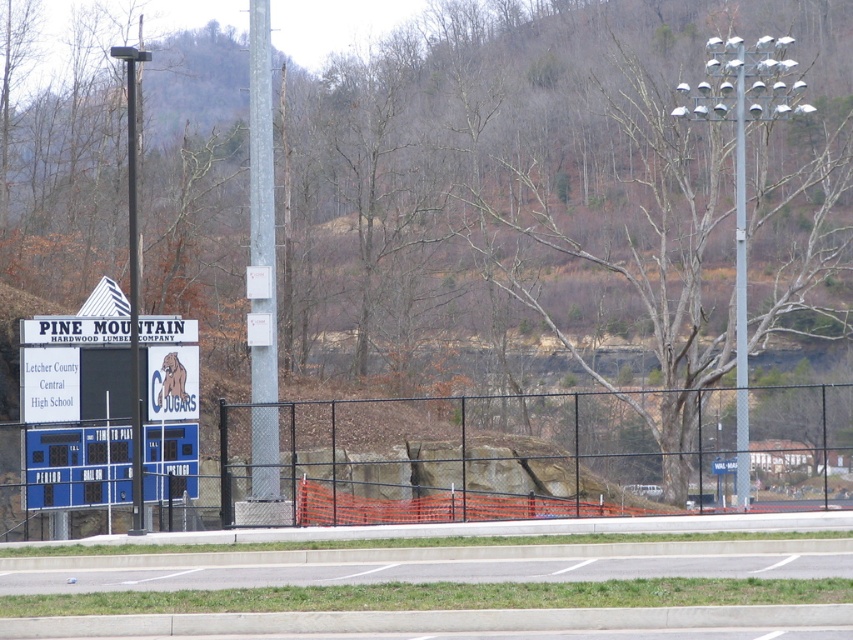
You are standing in front of the scoreboard at the sports field. There are two metallic gray poles in your view. Which one is closer to you, the metallic gray pole at center or the metallic gray pole at upper right?

The metallic gray pole at center is closer to you because it is further to the viewer than the metallic gray pole at upper right.